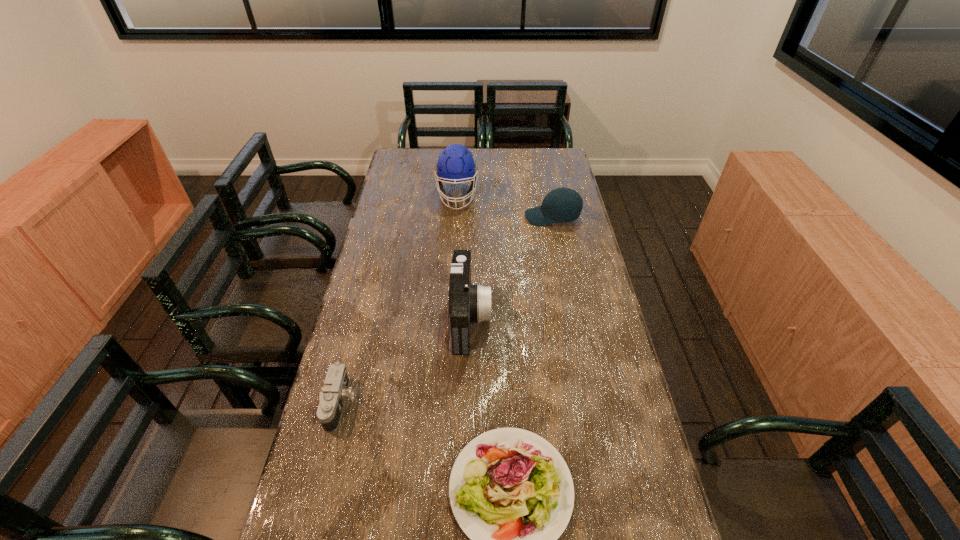
The width and height of the screenshot is (960, 540). Identify the location of vacant space located 0.350m on the front-facing side of the third shortest object. tap(438, 217).

You are a GUI agent. You are given a task and a screenshot of the screen. Output one action in this format:
    pyautogui.click(x=<x>, y=<y>)
    Task: Click on the vacant space located on the lens of the camera
    The height and width of the screenshot is (540, 960).
    Given the screenshot: What is the action you would take?
    pyautogui.click(x=376, y=403)

You are a GUI agent. You are given a task and a screenshot of the screen. Output one action in this format:
    pyautogui.click(x=<x>, y=<y>)
    Task: Click on the object that is at the left edge
    Image resolution: width=960 pixels, height=540 pixels.
    Given the screenshot: What is the action you would take?
    pyautogui.click(x=334, y=393)

Find the location of a particular element. Image resolution: width=960 pixels, height=540 pixels. object that is at the right edge is located at coordinates (563, 204).

Where is `free region at the far edge`? This screenshot has height=540, width=960. free region at the far edge is located at coordinates (516, 148).

The height and width of the screenshot is (540, 960). I want to click on free region at the left edge of the desktop, so click(x=341, y=443).

Identify the location of vacant space at the right edge of the desktop. The image size is (960, 540). (563, 319).

Image resolution: width=960 pixels, height=540 pixels. In the image, there is a desktop. In order to click on vacant space at the far right corner in this screenshot , I will do `click(557, 153)`.

Image resolution: width=960 pixels, height=540 pixels. I want to click on free spot between the third nearest object and the third tallest object, so click(x=512, y=268).

What are the coordinates of `vacant point located between the camcorder and the fourth tallest object` in the screenshot? It's located at (405, 361).